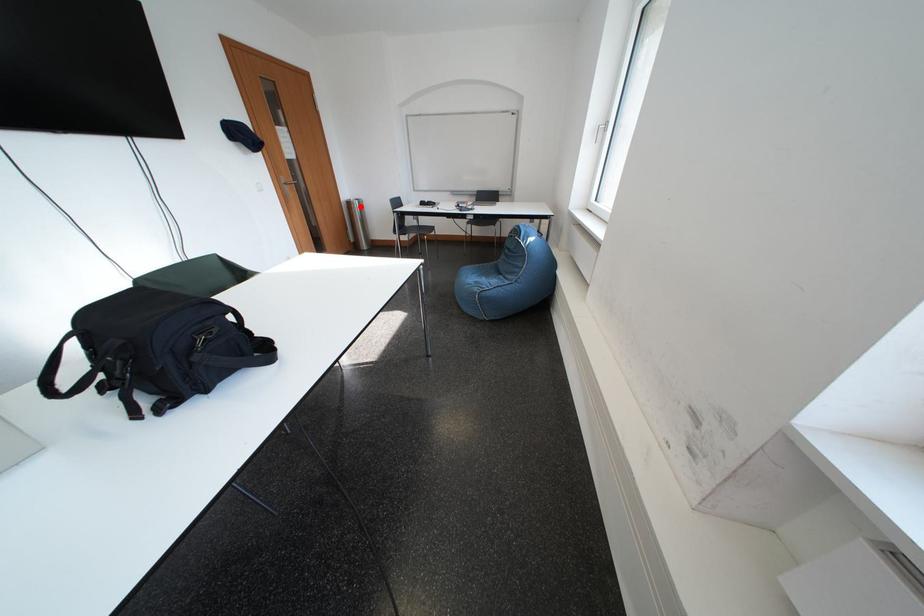
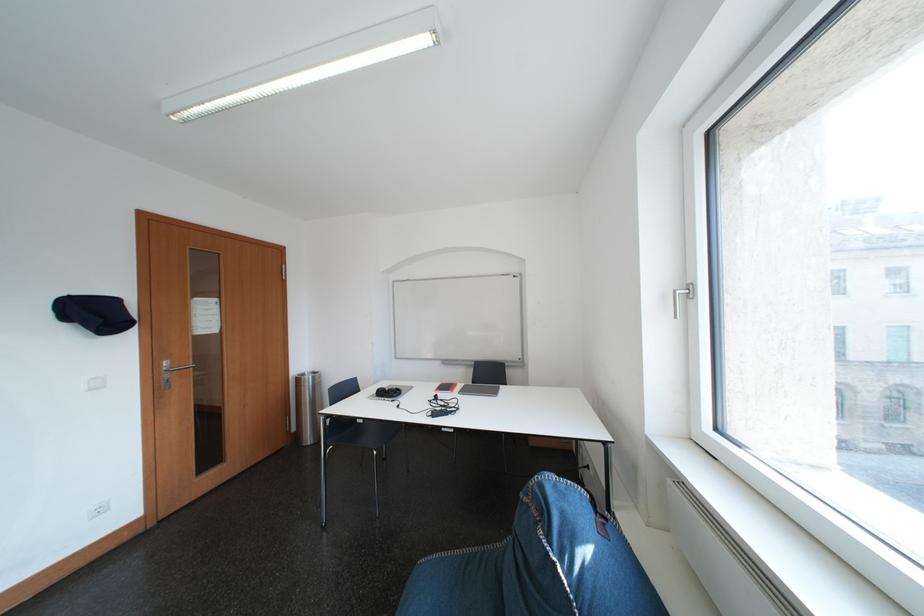
Locate, in the second image, the point that corresponds to the highlighted location in the first image.

(310, 383)